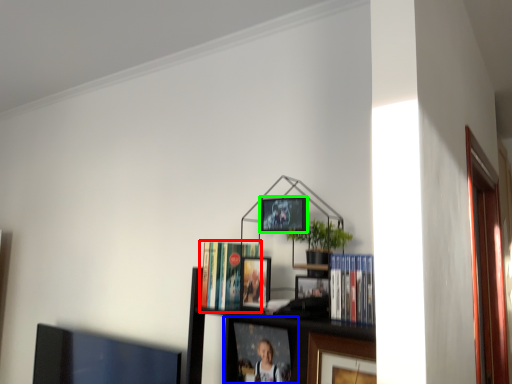
Question: Which object is the farthest from book (highlighted by a red box)? Choose among these: picture frame (highlighted by a blue box) or picture frame (highlighted by a green box).

Choices:
 (A) picture frame
 (B) picture frame

Answer: (A)